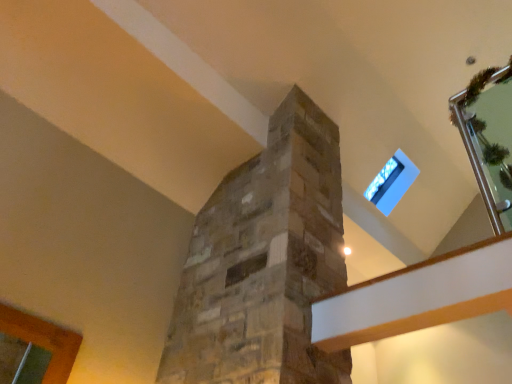
Question: Is clear glass door at upper right in front of transparent glass window at upper right?

Choices:
 (A) no
 (B) yes

Answer: (B)

Question: Considering the relative sizes of clear glass door at upper right and transparent glass window at upper right in the image provided, is clear glass door at upper right taller than transparent glass window at upper right?

Choices:
 (A) yes
 (B) no

Answer: (A)

Question: Is transparent glass window at upper right a part of clear glass door at upper right?

Choices:
 (A) yes
 (B) no

Answer: (B)

Question: From a real-world perspective, is clear glass door at upper right below transparent glass window at upper right?

Choices:
 (A) no
 (B) yes

Answer: (B)

Question: Does clear glass door at upper right have a larger size compared to transparent glass window at upper right?

Choices:
 (A) no
 (B) yes

Answer: (B)

Question: Is the depth of clear glass door at upper right greater than that of transparent glass window at upper right?

Choices:
 (A) yes
 (B) no

Answer: (B)

Question: Considering the relative sizes of transparent glass window at upper right and clear glass door at upper right in the image provided, is transparent glass window at upper right shorter than clear glass door at upper right?

Choices:
 (A) no
 (B) yes

Answer: (B)

Question: Does transparent glass window at upper right lie behind clear glass door at upper right?

Choices:
 (A) no
 (B) yes

Answer: (B)

Question: From the image's perspective, is transparent glass window at upper right beneath clear glass door at upper right?

Choices:
 (A) yes
 (B) no

Answer: (A)

Question: Considering the relative positions of transparent glass window at upper right and clear glass door at upper right in the image provided, is transparent glass window at upper right to the left of clear glass door at upper right from the viewer's perspective?

Choices:
 (A) yes
 (B) no

Answer: (A)

Question: From a real-world perspective, is transparent glass window at upper right below clear glass door at upper right?

Choices:
 (A) yes
 (B) no

Answer: (B)

Question: From a real-world perspective, is transparent glass window at upper right positioned over clear glass door at upper right based on gravity?

Choices:
 (A) yes
 (B) no

Answer: (A)

Question: Is transparent glass window at upper right to the left or to the right of clear glass door at upper right in the image?

Choices:
 (A) right
 (B) left

Answer: (B)